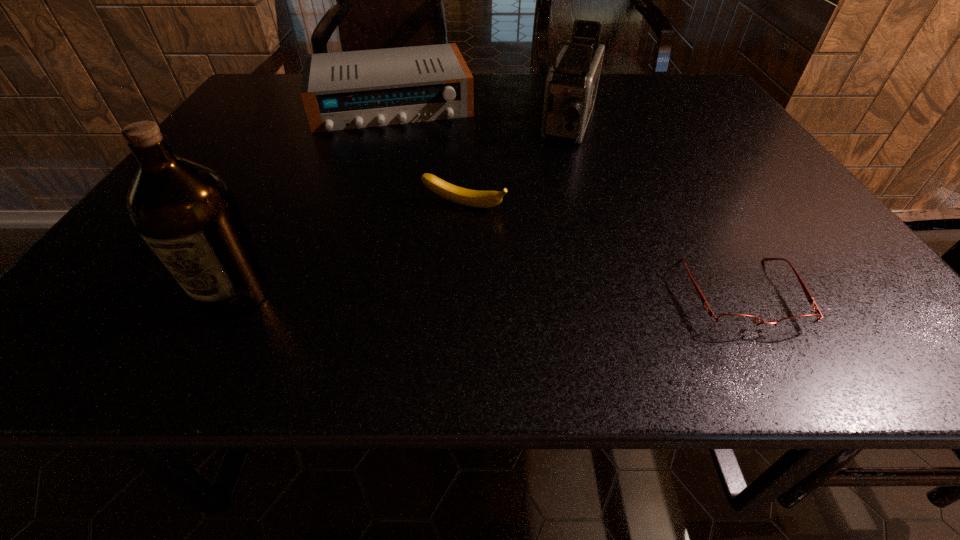
What are the coordinates of `free space located at the lens of the second tallest object` in the screenshot? It's located at (533, 248).

What are the coordinates of `vacant space located 0.130m on the control panel of the radio receiver` in the screenshot? It's located at (407, 162).

What are the coordinates of `free space located 0.050m on the control panel of the radio receiver` in the screenshot? It's located at (403, 145).

In order to click on vacant space located on the control panel of the radio receiver in this screenshot , I will do `click(415, 204)`.

This screenshot has height=540, width=960. Find the location of `vacant space positioned 0.140m at the stem of the third farthest object`. vacant space positioned 0.140m at the stem of the third farthest object is located at coordinates (429, 266).

What are the coordinates of `vacant space located 0.130m at the stem of the third farthest object` in the screenshot? It's located at (431, 262).

This screenshot has width=960, height=540. Identify the location of vacant space situated 0.200m at the stem of the third farthest object. (417, 291).

I want to click on camcorder at the far edge, so click(x=571, y=86).

Where is `radio receiver that is positioned at the far edge`? This screenshot has height=540, width=960. radio receiver that is positioned at the far edge is located at coordinates [355, 89].

Where is `olive oil present at the near edge`? Image resolution: width=960 pixels, height=540 pixels. olive oil present at the near edge is located at coordinates (188, 215).